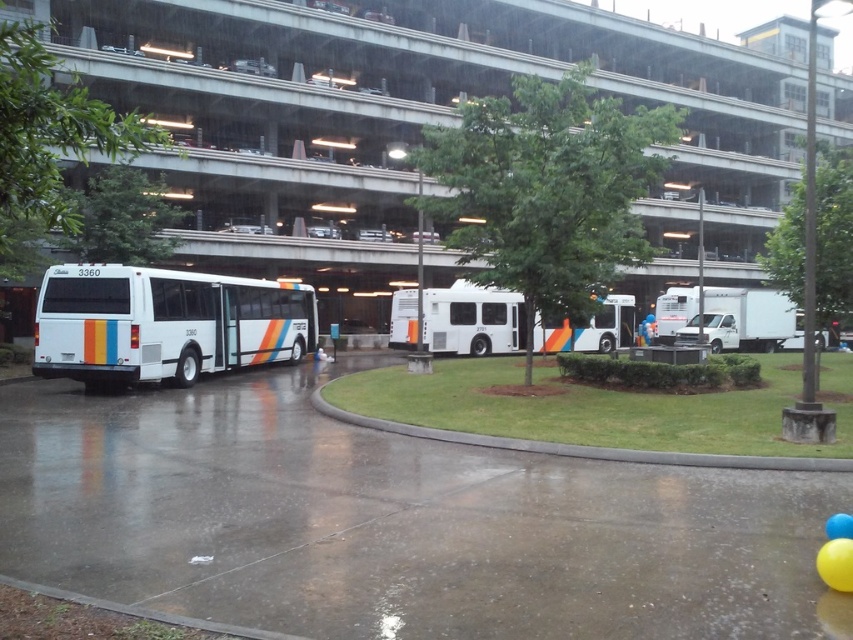
Question: Which of the following is the closest to the observer?

Choices:
 (A) white matte bus at center
 (B) white concrete parking garage at upper center
 (C) blue rubber balloon at lower right
 (D) concrete pavement at lower left

Answer: (D)

Question: Which point is farther to the camera?

Choices:
 (A) white matte bus at center
 (B) white glossy bus at left
 (C) yellow rubber balloon at lower right

Answer: (B)

Question: Can you confirm if concrete pavement at lower left is positioned to the left of blue rubber balloon at lower right?

Choices:
 (A) yes
 (B) no

Answer: (A)

Question: In this image, where is white glossy bus at left located relative to yellow rubber balloon at lower right?

Choices:
 (A) right
 (B) left

Answer: (B)

Question: Among these objects, which one is nearest to the camera?

Choices:
 (A) white glossy bus at left
 (B) blue rubber balloon at lower right
 (C) green grass at lower center
 (D) white concrete parking garage at upper center

Answer: (B)

Question: Is white concrete parking garage at upper center bigger than white matte bus at center?

Choices:
 (A) no
 (B) yes

Answer: (B)